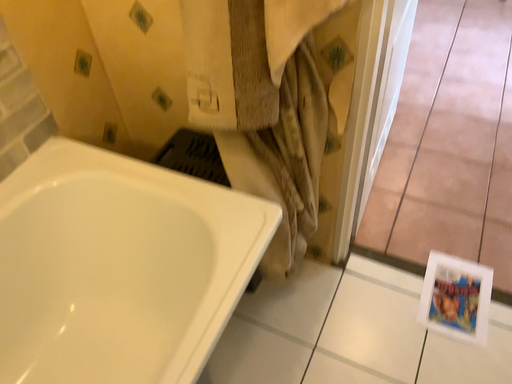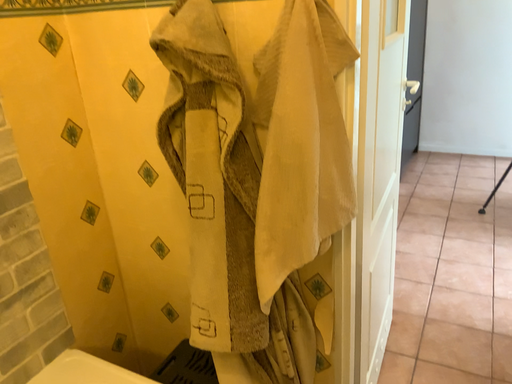
Question: How did the camera likely rotate when shooting the video?

Choices:
 (A) rotated upward
 (B) rotated downward

Answer: (A)